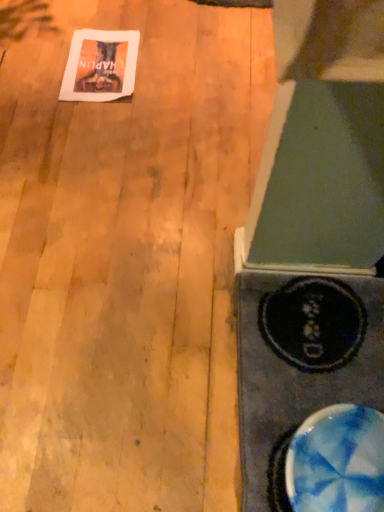
Identify the location of wooden floor at upper left. (125, 257).

What do you see at coordinates (337, 461) in the screenshot? I see `blue marbled bowl at lower right` at bounding box center [337, 461].

The width and height of the screenshot is (384, 512). I want to click on wooden floor at upper left, so click(x=125, y=257).

Does blue marbled bowl at lower right have a larger size compared to white paper at upper left?

Yes.

From a real-world perspective, is blue marbled bowl at lower right located beneath white paper at upper left?

No.

Find the location of a particular element. The height and width of the screenshot is (512, 384). postcard located behind the blue marbled bowl at lower right is located at coordinates (100, 66).

Considering the sizes of objects wooden floor at upper left and white paper at upper left in the image provided, who is taller, wooden floor at upper left or white paper at upper left?

wooden floor at upper left.

Relative to white paper at upper left, is wooden floor at upper left in front or behind?

Clearly, wooden floor at upper left is in front of white paper at upper left.

Would you consider wooden floor at upper left to be distant from white paper at upper left?

No, wooden floor at upper left is not far from white paper at upper left.

Do you think wooden floor at upper left is within white paper at upper left, or outside of it?

wooden floor at upper left is located beyond the bounds of white paper at upper left.

From the image's perspective, is white paper at upper left under blue marbled bowl at lower right?

No.

Where is `postcard lying on the left of blue marbled bowl at lower right`? The height and width of the screenshot is (512, 384). postcard lying on the left of blue marbled bowl at lower right is located at coordinates (100, 66).

Is blue marbled bowl at lower right inside white paper at upper left?

No.

From a real-world perspective, which is physically below, white paper at upper left or blue marbled bowl at lower right?

white paper at upper left is physically lower.

Which is correct: wooden floor at upper left is inside blue marbled bowl at lower right, or outside of it?

wooden floor at upper left is spatially situated outside blue marbled bowl at lower right.

Considering the sizes of objects wooden floor at upper left and blue marbled bowl at lower right in the image provided, who is smaller, wooden floor at upper left or blue marbled bowl at lower right?

blue marbled bowl at lower right.

Is wooden floor at upper left turned away from blue marbled bowl at lower right?

wooden floor at upper left is not turned away from blue marbled bowl at lower right.

Is the depth of wooden floor at upper left greater than that of blue marbled bowl at lower right?

That is True.

Looking at this image, which is less distant, (91, 65) or (200, 61)?

The point (91, 65) is in front.

Is white paper at upper left far away from wooden floor at upper left?

Actually, white paper at upper left and wooden floor at upper left are a little close together.

Measure the distance between white paper at upper left and wooden floor at upper left.

A distance of 11.29 inches exists between white paper at upper left and wooden floor at upper left.

Is white paper at upper left positioned with its back to wooden floor at upper left?

Absolutely, white paper at upper left is directed away from wooden floor at upper left.

Is blue marbled bowl at lower right positioned beyond the bounds of wooden floor at upper left?

blue marbled bowl at lower right lies outside wooden floor at upper left's area.

From their relative heights in the image, would you say blue marbled bowl at lower right is taller or shorter than wooden floor at upper left?

Considering their sizes, blue marbled bowl at lower right has more height than wooden floor at upper left.

Identify the location of postcard above the blue marbled bowl at lower right (from the image's perspective). This screenshot has width=384, height=512. (100, 66).

Image resolution: width=384 pixels, height=512 pixels. Find the location of `postcard to the left of wooden floor at upper left`. postcard to the left of wooden floor at upper left is located at coordinates (100, 66).

When comparing their distances from white paper at upper left, does wooden floor at upper left or blue marbled bowl at lower right seem further?

blue marbled bowl at lower right lies further to white paper at upper left than the other object.

Estimate the real-world distances between objects in this image. Which object is closer to white paper at upper left, blue marbled bowl at lower right or wooden floor at upper left?

Among the two, wooden floor at upper left is located nearer to white paper at upper left.

Estimate the real-world distances between objects in this image. Which object is further from blue marbled bowl at lower right, wooden floor at upper left or white paper at upper left?

white paper at upper left lies further to blue marbled bowl at lower right than the other object.

Looking at the image, which one is located further to wooden floor at upper left, blue marbled bowl at lower right or white paper at upper left?

blue marbled bowl at lower right is further to wooden floor at upper left.

Based on their spatial positions, is white paper at upper left or blue marbled bowl at lower right further from wooden floor at upper left?

Based on the image, blue marbled bowl at lower right appears to be further to wooden floor at upper left.

From the image, which object appears to be farther from blue marbled bowl at lower right, white paper at upper left or wooden floor at upper left?

white paper at upper left.

Where is `plywood between white paper at upper left and blue marbled bowl at lower right in the vertical direction`? plywood between white paper at upper left and blue marbled bowl at lower right in the vertical direction is located at coordinates (125, 257).